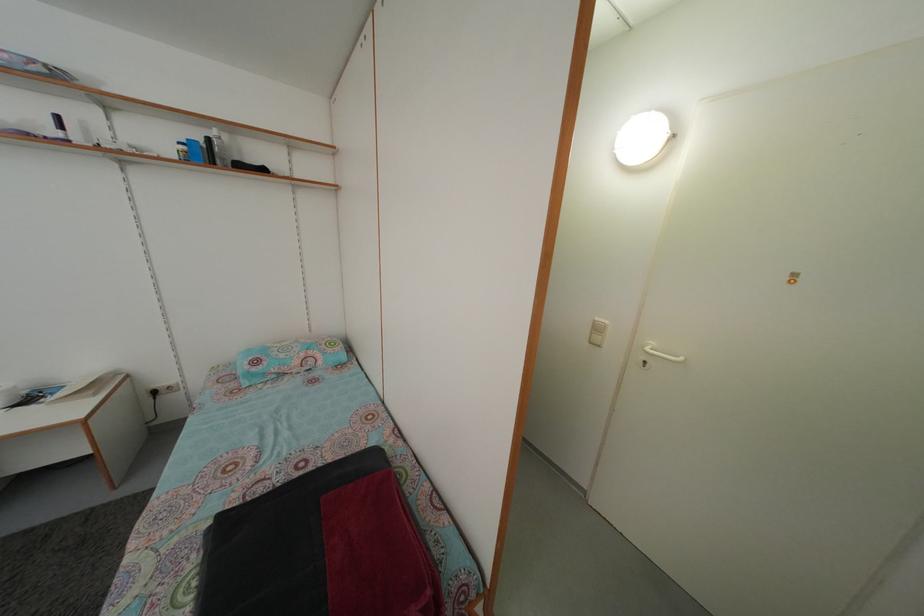
Find where to insert the door keyhole. Please return your answer as a coordinate pair (x, y).

(643, 363)